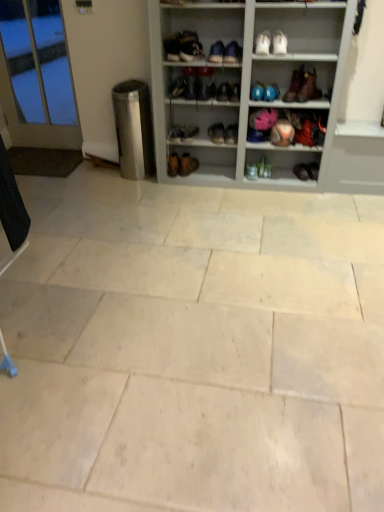
Where is `free space in front of matte blue shoe at center, the 1th shoe in the right-to-left sequence`? free space in front of matte blue shoe at center, the 1th shoe in the right-to-left sequence is located at coordinates (277, 182).